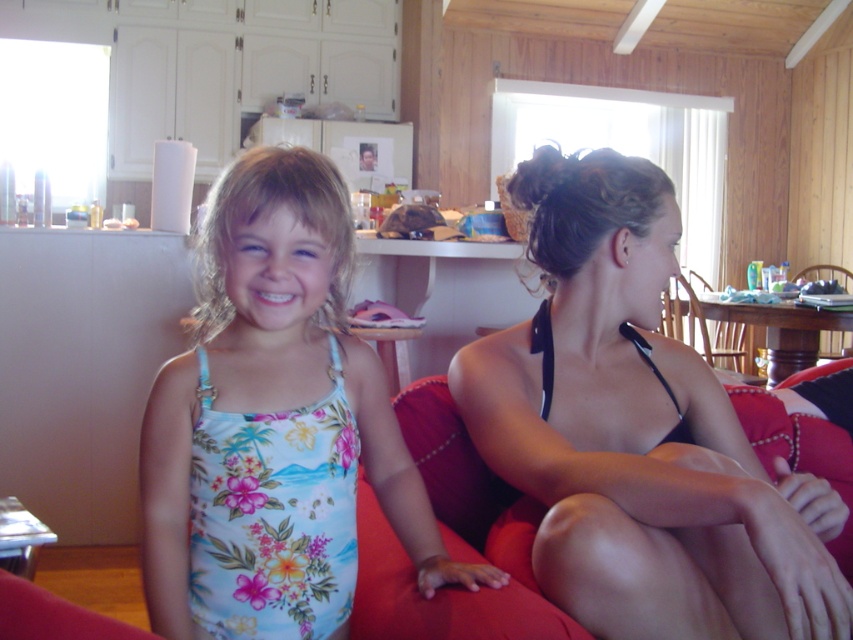
Based on the photo, does black satin bikini top at upper right appear on the right side of floral print swimsuit at left?

Yes, black satin bikini top at upper right is to the right of floral print swimsuit at left.

Measure the distance between point (631, 371) and camera.

They are 4.29 feet apart.

I want to click on black satin bikini top at upper right, so click(637, 433).

Based on the photo, does floral print swimsuit at left have a lesser width compared to red fabric couch at center?

In fact, floral print swimsuit at left might be wider than red fabric couch at center.

Who is positioned more to the left, floral print swimsuit at left or red fabric couch at center?

floral print swimsuit at left

This screenshot has height=640, width=853. Identify the location of floral print swimsuit at left. (274, 424).

Between black satin bikini top at upper right and red fabric couch at center, which one is positioned higher?

Positioned higher is black satin bikini top at upper right.

The width and height of the screenshot is (853, 640). What do you see at coordinates (637, 433) in the screenshot?
I see `black satin bikini top at upper right` at bounding box center [637, 433].

What are the coordinates of `black satin bikini top at upper right` in the screenshot? It's located at (637, 433).